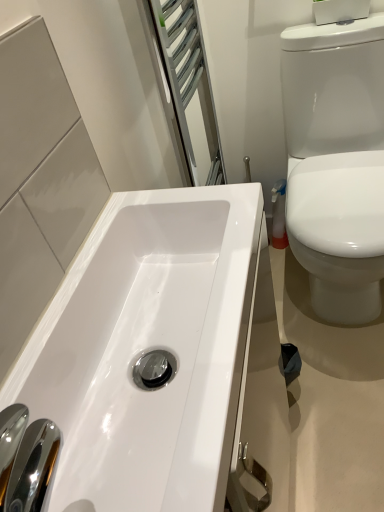
At what (x,y) coordinates should I click in order to perform the action: click on white glossy sink at lower left. Please return your answer as a coordinate pair (x, y). Looking at the image, I should click on (148, 350).

Measure the distance between white glossy sink at lower left and camera.

white glossy sink at lower left is 13.26 inches from camera.

Image resolution: width=384 pixels, height=512 pixels. Describe the element at coordinates (148, 350) in the screenshot. I see `white glossy sink at lower left` at that location.

What is the approximate width of white glossy toilet at right?

white glossy toilet at right is 25.77 inches wide.

The image size is (384, 512). Find the location of `white glossy toilet at right`. white glossy toilet at right is located at coordinates (336, 162).

The width and height of the screenshot is (384, 512). Describe the element at coordinates (336, 162) in the screenshot. I see `white glossy toilet at right` at that location.

Identify the location of white glossy sink at lower left. (148, 350).

In the scene shown: Based on their positions, is white glossy sink at lower left located to the left or right of white glossy toilet at right?

Clearly, white glossy sink at lower left is on the left of white glossy toilet at right in the image.

Between white glossy sink at lower left and white glossy toilet at right, which one is positioned in front?

white glossy sink at lower left is closer to the camera.

Between point (197, 287) and point (370, 51), which one is positioned in front?

The point (197, 287) is closer to the camera.

From the image's perspective, is white glossy sink at lower left located above or below white glossy toilet at right?

From the image's perspective, white glossy sink at lower left appears below white glossy toilet at right.

From a real-world perspective, is white glossy sink at lower left above or below white glossy toilet at right?

white glossy sink at lower left is situated higher than white glossy toilet at right in the real world.

Looking at their sizes, would you say white glossy sink at lower left is wider or thinner than white glossy toilet at right?

Considering their sizes, white glossy sink at lower left looks slimmer than white glossy toilet at right.

In terms of height, does white glossy sink at lower left look taller or shorter compared to white glossy toilet at right?

In the image, white glossy sink at lower left appears to be shorter than white glossy toilet at right.

Does white glossy sink at lower left have a larger size compared to white glossy toilet at right?

Actually, white glossy sink at lower left might be smaller than white glossy toilet at right.

Is white glossy sink at lower left situated inside white glossy toilet at right or outside?

white glossy sink at lower left exists outside the volume of white glossy toilet at right.

Is white glossy sink at lower left next to white glossy toilet at right?

No, white glossy sink at lower left is not with white glossy toilet at right.

Is white glossy sink at lower left turned away from white glossy toilet at right?

No, white glossy sink at lower left is not facing away from white glossy toilet at right.

Measure the distance between white glossy sink at lower left and white glossy toilet at right.

The distance of white glossy sink at lower left from white glossy toilet at right is 27.91 inches.

Find the location of a particular element. Image resolution: width=384 pixels, height=512 pixels. toilet behind the white glossy sink at lower left is located at coordinates (336, 162).

Based on the photo, which object is positioned more to the right, white glossy toilet at right or white glossy sink at lower left?

white glossy toilet at right is more to the right.

Which object is more forward, white glossy toilet at right or white glossy sink at lower left?

white glossy sink at lower left is more forward.

Which is behind, point (316, 225) or point (21, 389)?

The point (316, 225) is farther.

From the image's perspective, which is below, white glossy toilet at right or white glossy sink at lower left?

white glossy sink at lower left is shown below in the image.

From a real-world perspective, is white glossy toilet at right on top of white glossy sink at lower left?

No, from a real-world perspective, white glossy toilet at right is not on top of white glossy sink at lower left.

Considering the sizes of objects white glossy toilet at right and white glossy sink at lower left in the image provided, who is thinner, white glossy toilet at right or white glossy sink at lower left?

white glossy sink at lower left is thinner.

Which of these two, white glossy toilet at right or white glossy sink at lower left, stands taller?

white glossy toilet at right.

Consider the image. Considering the relative sizes of white glossy toilet at right and white glossy sink at lower left in the image provided, is white glossy toilet at right smaller than white glossy sink at lower left?

No.

Based on the photo, is white glossy toilet at right inside or outside of white glossy sink at lower left?

white glossy toilet at right exists outside the volume of white glossy sink at lower left.

From the picture: Is white glossy toilet at right touching white glossy sink at lower left?

No.

Is white glossy toilet at right looking in the opposite direction of white glossy sink at lower left?

No, white glossy toilet at right's orientation is not away from white glossy sink at lower left.

In the scene shown: How many degrees apart are the facing directions of white glossy toilet at right and white glossy sink at lower left?

They differ by 88.5 degrees in their facing directions.

The width and height of the screenshot is (384, 512). In order to click on toilet on the right of white glossy sink at lower left in this screenshot , I will do `click(336, 162)`.

Identify the location of sink on the left side of white glossy toilet at right. This screenshot has height=512, width=384. (148, 350).

Identify the location of toilet above the white glossy sink at lower left (from the image's perspective). (336, 162).